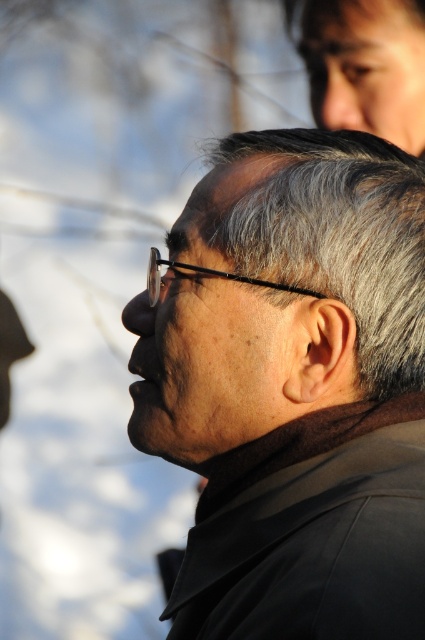
Question: In this image, where is matte black jacket at center located relative to gray matte hair at center?

Choices:
 (A) left
 (B) right

Answer: (A)

Question: Which object is closer to the camera taking this photo?

Choices:
 (A) matte black jacket at center
 (B) gray matte hair at center

Answer: (A)

Question: Is matte black jacket at center closer to the viewer compared to gray matte hair at center?

Choices:
 (A) no
 (B) yes

Answer: (B)

Question: Is matte black jacket at center smaller than gray matte hair at center?

Choices:
 (A) no
 (B) yes

Answer: (A)

Question: Which point is farther from the camera taking this photo?

Choices:
 (A) (300, 278)
 (B) (234, 333)

Answer: (B)

Question: Which object appears farthest from the camera in this image?

Choices:
 (A) matte black jacket at center
 (B) gray matte hair at center

Answer: (B)